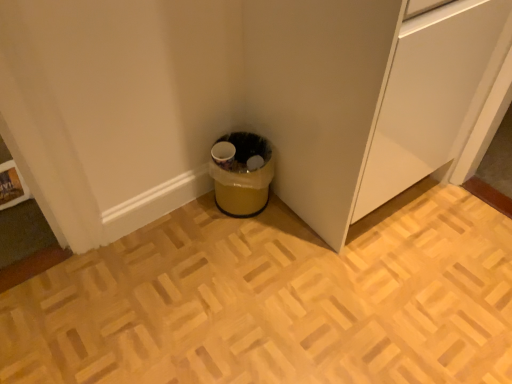
Locate an element on the screen. white matte cabinet at lower center is located at coordinates click(x=433, y=94).

The image size is (512, 384). Describe the element at coordinates (433, 94) in the screenshot. I see `white matte cabinet at lower center` at that location.

What do you see at coordinates (242, 174) in the screenshot? Image resolution: width=512 pixels, height=384 pixels. I see `yellow plastic trash can at lower center` at bounding box center [242, 174].

The height and width of the screenshot is (384, 512). I want to click on yellow plastic trash can at lower center, so click(242, 174).

At what (x,y) coordinates should I click in order to perform the action: click on white matte cabinet at lower center. Please return your answer as a coordinate pair (x, y). This screenshot has height=384, width=512. Looking at the image, I should click on (433, 94).

Would you say yellow plastic trash can at lower center is to the left or to the right of white matte cabinet at lower center in the picture?

From the image, it's evident that yellow plastic trash can at lower center is to the left of white matte cabinet at lower center.

Is yellow plastic trash can at lower center in front of or behind white matte cabinet at lower center in the image?

yellow plastic trash can at lower center is positioned farther from the viewer than white matte cabinet at lower center.

Is point (249, 191) closer to viewer compared to point (478, 7)?

No, it is not.

From the image's perspective, relative to white matte cabinet at lower center, is yellow plastic trash can at lower center above or below?

From the image's perspective, yellow plastic trash can at lower center appears below white matte cabinet at lower center.

From a real-world perspective, relative to white matte cabinet at lower center, is yellow plastic trash can at lower center vertically above or below?

Clearly, from a real-world perspective, yellow plastic trash can at lower center is below white matte cabinet at lower center.

Between yellow plastic trash can at lower center and white matte cabinet at lower center, which one has larger width?

Wider between the two is white matte cabinet at lower center.

Is yellow plastic trash can at lower center shorter than white matte cabinet at lower center?

Indeed, yellow plastic trash can at lower center has a lesser height compared to white matte cabinet at lower center.

In terms of size, does yellow plastic trash can at lower center appear bigger or smaller than white matte cabinet at lower center?

yellow plastic trash can at lower center is smaller than white matte cabinet at lower center.

Would you say yellow plastic trash can at lower center is inside or outside white matte cabinet at lower center?

yellow plastic trash can at lower center is not inside white matte cabinet at lower center, it's outside.

Are yellow plastic trash can at lower center and white matte cabinet at lower center far apart?

They are positioned close to each other.

Is yellow plastic trash can at lower center positioned with its back to white matte cabinet at lower center?

No, yellow plastic trash can at lower center is not facing away from white matte cabinet at lower center.

What's the angular difference between yellow plastic trash can at lower center and white matte cabinet at lower center's facing directions?

0.233 degrees separate the facing orientations of yellow plastic trash can at lower center and white matte cabinet at lower center.

Locate an element on the screen. This screenshot has width=512, height=384. cabinetry above the yellow plastic trash can at lower center (from the image's perspective) is located at coordinates (433, 94).

Which is more to the right, white matte cabinet at lower center or yellow plastic trash can at lower center?

white matte cabinet at lower center.

Is white matte cabinet at lower center further to the viewer compared to yellow plastic trash can at lower center?

No, the depth of white matte cabinet at lower center is less than that of yellow plastic trash can at lower center.

Which point is more distant from viewer, (424, 151) or (265, 192)?

Point (265, 192)

From the image's perspective, is white matte cabinet at lower center positioned above or below yellow plastic trash can at lower center?

From the image's perspective, white matte cabinet at lower center appears above yellow plastic trash can at lower center.

From a real-world perspective, who is located higher, white matte cabinet at lower center or yellow plastic trash can at lower center?

From a 3D spatial view, white matte cabinet at lower center is above.

From the picture: Looking at their sizes, would you say white matte cabinet at lower center is wider or thinner than yellow plastic trash can at lower center?

Clearly, white matte cabinet at lower center has more width compared to yellow plastic trash can at lower center.

Is white matte cabinet at lower center taller or shorter than yellow plastic trash can at lower center?

white matte cabinet at lower center is taller than yellow plastic trash can at lower center.

Based on the photo, who is bigger, white matte cabinet at lower center or yellow plastic trash can at lower center?

white matte cabinet at lower center is bigger.

Is white matte cabinet at lower center completely or partially outside of yellow plastic trash can at lower center?

Yes, white matte cabinet at lower center is outside of yellow plastic trash can at lower center.

Is white matte cabinet at lower center with yellow plastic trash can at lower center?

white matte cabinet at lower center and yellow plastic trash can at lower center are clearly separated.

Is white matte cabinet at lower center facing away from yellow plastic trash can at lower center?

No, yellow plastic trash can at lower center is not at the back of white matte cabinet at lower center.

This screenshot has width=512, height=384. I want to click on cabinetry above the yellow plastic trash can at lower center (from a real-world perspective), so click(433, 94).

Where is `cabinetry located above the yellow plastic trash can at lower center (from a real-world perspective)`? The width and height of the screenshot is (512, 384). cabinetry located above the yellow plastic trash can at lower center (from a real-world perspective) is located at coordinates (433, 94).

Where is `waste container below the white matte cabinet at lower center (from the image's perspective)`? The width and height of the screenshot is (512, 384). waste container below the white matte cabinet at lower center (from the image's perspective) is located at coordinates (242, 174).